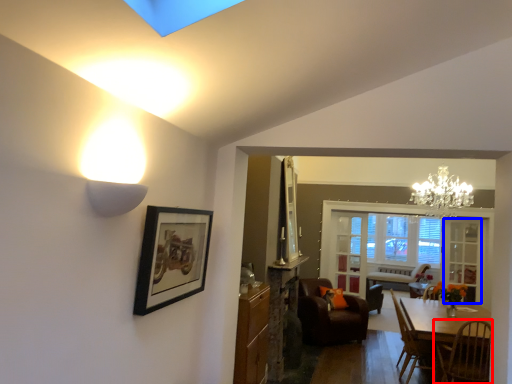
Question: Which object appears closest to the camera in this image, chair (highlighted by a red box) or glass door (highlighted by a blue box)?

Choices:
 (A) chair
 (B) glass door

Answer: (A)